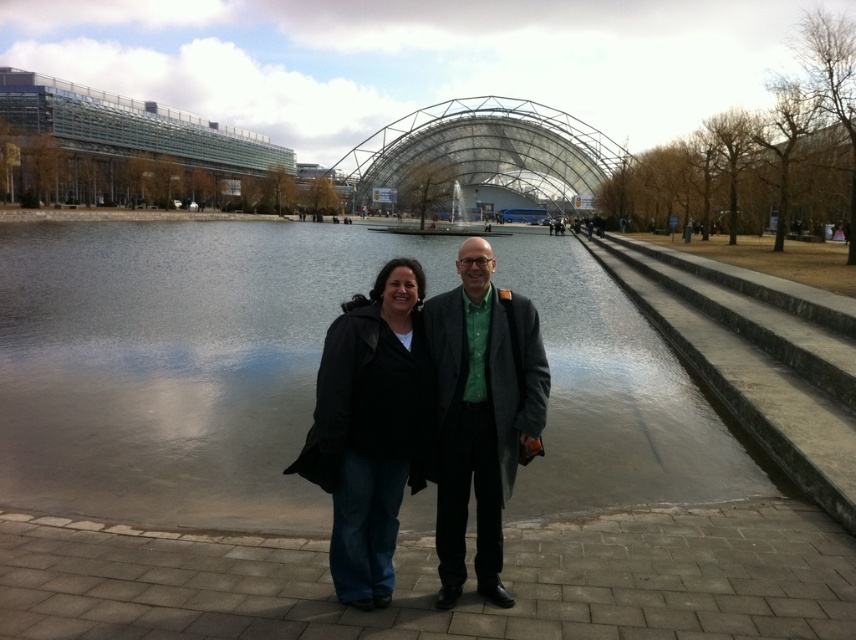
You are a photographer trying to capture the smooth concrete water at center and the black leather jacket at center in the same frame. Based on their positions, which object will appear larger in the photo?

The smooth concrete water at center will appear larger in the photo because it has a greater height compared to the black leather jacket at center.

In the scene shown: You are a fashion designer observing two coats displayed in a store window. The coats are the black leather jacket at center and the matte gray coat at center. Which coat has a longer length?

The matte gray coat at center is longer than the black leather jacket at center.